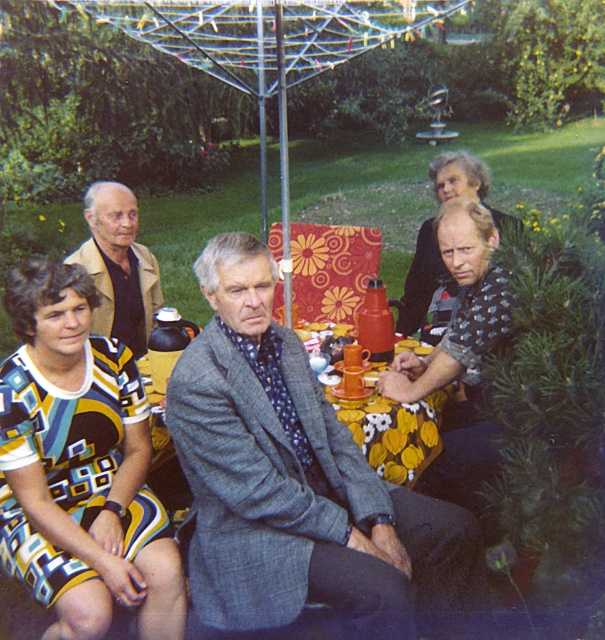
You are organizing a photo shoot and need to ensure that the geometric print dress at lower left and the patterned fabric dress at center are visible in the frame. Based on their positions and sizes, which dress might require more space in the composition?

The geometric print dress at lower left might require more space in the composition since it is wider than the patterned fabric dress at center according to the description.